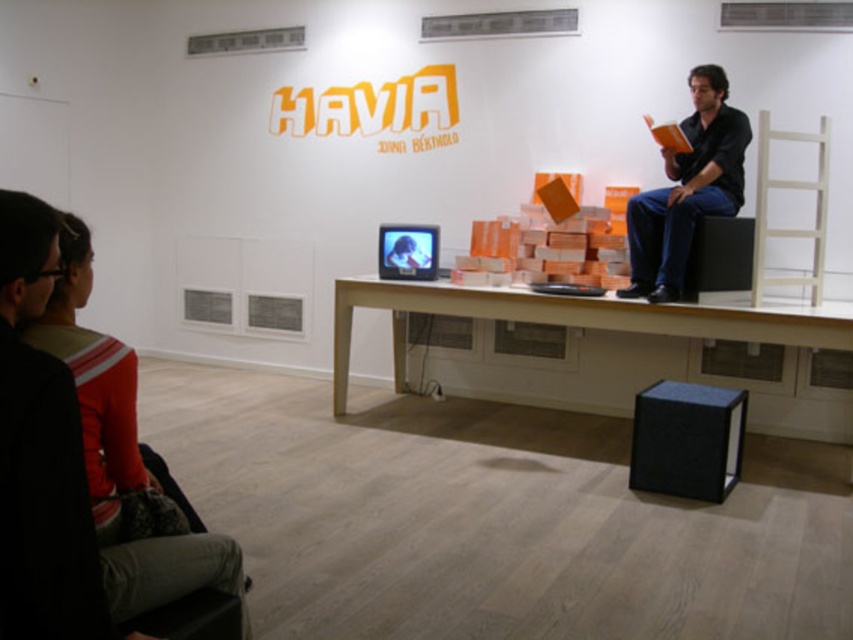
You are an art curator setting up an exhibition. You need to place a decorative item that requires a 2.5 meter clearance between the orange sweater at upper left and the black fabric speaker at lower center. Is the current placement sufficient?

The distance between the orange sweater at upper left and the black fabric speaker at lower center is 2.37 meters, which is less than the required 2.5 meters. The current placement does not meet the clearance requirement.

You are standing in the art gallery and see the orange sweater at upper left and the white wood table at center. Which object is nearer to you?

The orange sweater at upper left is closer to the viewer than the white wood table at center.

Based on the photo, you are standing at the entrance of the gallery facing the back wall with the orange text. There are two points marked in the room, point (151, 564) and point (659, 385). Which point is closer to you?

Point (151, 564) is in front of point (659, 385), so it is closer to you.